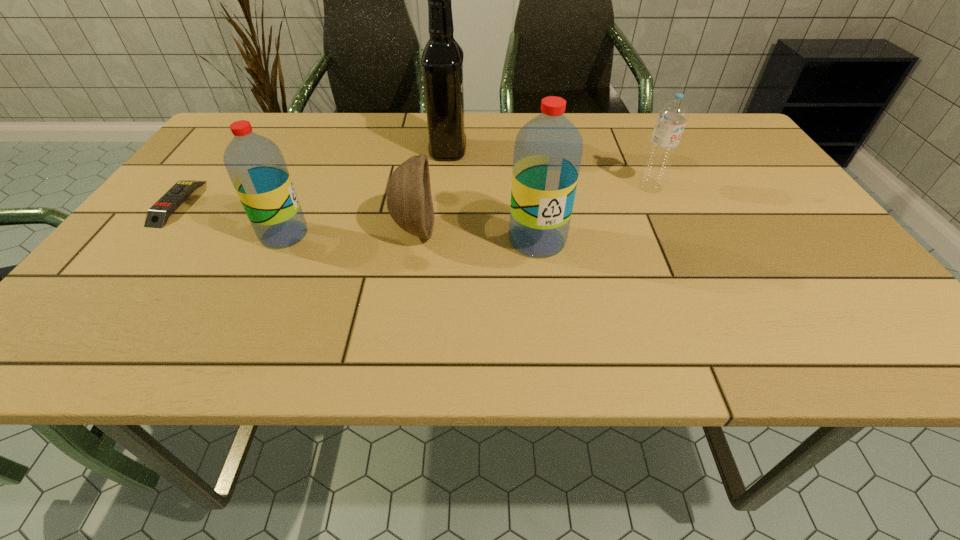
What are the coordinates of `vacant area that lies between the leftmost object and the leftmost water bottle` in the screenshot? It's located at (230, 219).

Identify which object is the fifth closest to the rightmost water bottle. Please provide its 2D coordinates. Your answer should be formatted as a tuple, i.e. [(x, y)], where the tuple contains the x and y coordinates of a point satisfying the conditions above.

[(157, 216)]

I want to click on object that ranks as the fifth closest to the fifth object from right to left, so click(672, 116).

You are a GUI agent. You are given a task and a screenshot of the screen. Output one action in this format:
    pyautogui.click(x=<x>, y=<y>)
    Task: Click on the water bottle that is the closest to the remote control
    This screenshot has height=540, width=960.
    Given the screenshot: What is the action you would take?
    pyautogui.click(x=255, y=164)

Where is `the third closest water bottle to the bowl`? the third closest water bottle to the bowl is located at coordinates (672, 116).

Image resolution: width=960 pixels, height=540 pixels. I want to click on free spot that satisfies the following two spatial constraints: 1. on the front side of the bowl; 2. on the right side of the leftmost object, so click(156, 230).

At what (x,y) coordinates should I click in order to perform the action: click on free space that satisfies the following two spatial constraints: 1. on the front-facing side of the rightmost water bottle; 2. on the right side of the liquor. Please return your answer as a coordinate pair (x, y). Looking at the image, I should click on (444, 187).

Locate an element on the screen. The height and width of the screenshot is (540, 960). free space that satisfies the following two spatial constraints: 1. on the front side of the rightmost water bottle; 2. on the front label of the leftmost water bottle is located at coordinates (673, 234).

At what (x,y) coordinates should I click in order to perform the action: click on free region that satisfies the following two spatial constraints: 1. on the front side of the rightmost object; 2. on the front label of the second object from left to right. Please return your answer as a coordinate pair (x, y). Looking at the image, I should click on (673, 234).